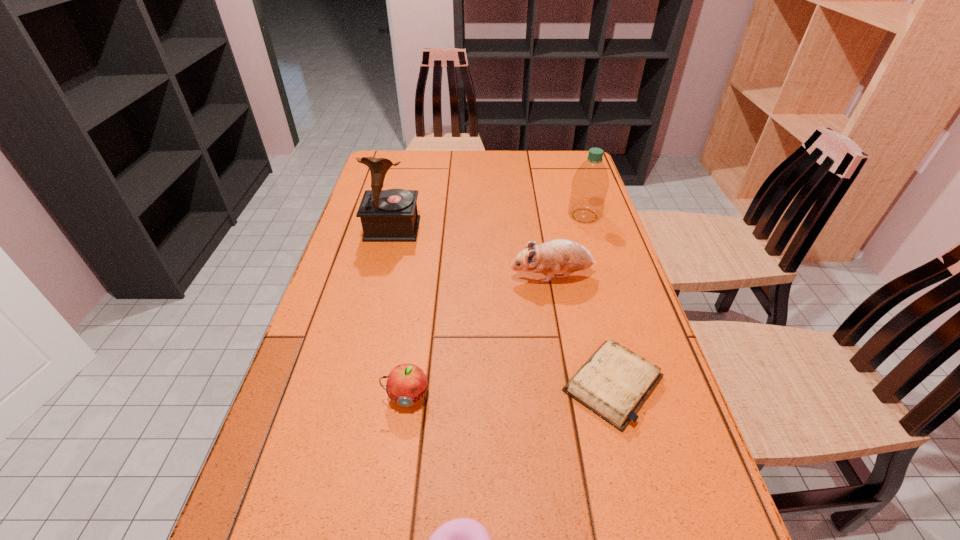
This screenshot has width=960, height=540. In the image, there is a desktop. Identify the location of vacant space at the far left corner. (394, 179).

What are the coordinates of `unoccupied area between the phonograph_record and the hamster` in the screenshot? It's located at (472, 253).

Identify the location of free area in between the shortest object and the fourth nearest object. Image resolution: width=960 pixels, height=540 pixels. (583, 330).

At what (x,y) coordinates should I click in order to perform the action: click on vacant area that lies between the diary and the phonograph_record. Please return your answer as a coordinate pair (x, y). The image size is (960, 540). Looking at the image, I should click on (503, 306).

Identify the location of empty space that is in between the phonograph_record and the hamster. The image size is (960, 540). (472, 253).

In order to click on free spot between the diary and the fourth tallest object in this screenshot , I will do `click(510, 390)`.

Where is `free spot between the water bottle and the third shortest object`? free spot between the water bottle and the third shortest object is located at coordinates (496, 306).

Select which object appears as the second closest to the nearest object. Please provide its 2D coordinates. Your answer should be formatted as a tuple, i.e. [(x, y)], where the tuple contains the x and y coordinates of a point satisfying the conditions above.

[(614, 382)]

Locate an element on the screen. The image size is (960, 540). object that ranks as the closest to the water bottle is located at coordinates (565, 256).

This screenshot has width=960, height=540. I want to click on vacant space that satisfies the following two spatial constraints: 1. at the horn opening of the phonograph_record; 2. on the right side of the apple, so click(350, 396).